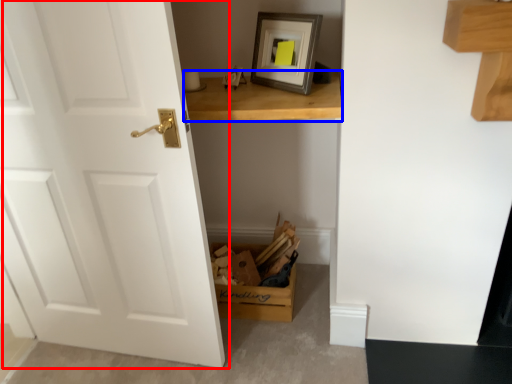
Question: Which of the following is the closest to the observer, door (highlighted by a red box) or table (highlighted by a blue box)?

Choices:
 (A) door
 (B) table

Answer: (A)